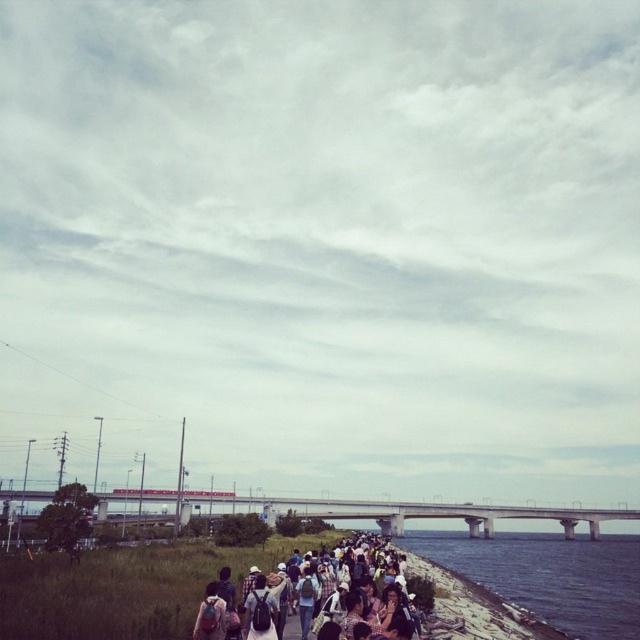
Question: Estimate the real-world distances between objects in this image. Which object is closer to the matte black backpack at center?

Choices:
 (A) concrete bridge at center
 (B) clear water at lower right

Answer: (B)

Question: Which object is the farthest from the concrete bridge at center?

Choices:
 (A) matte black backpack at center
 (B) clear water at lower right

Answer: (A)

Question: Can you confirm if clear water at lower right is positioned below concrete bridge at center?

Choices:
 (A) yes
 (B) no

Answer: (A)

Question: Can you confirm if clear water at lower right is bigger than matte black backpack at center?

Choices:
 (A) no
 (B) yes

Answer: (B)

Question: Which point appears closest to the camera in this image?

Choices:
 (A) (609, 568)
 (B) (336, 506)
 (C) (260, 634)

Answer: (C)

Question: Can you confirm if matte black backpack at center is bigger than concrete bridge at center?

Choices:
 (A) no
 (B) yes

Answer: (A)